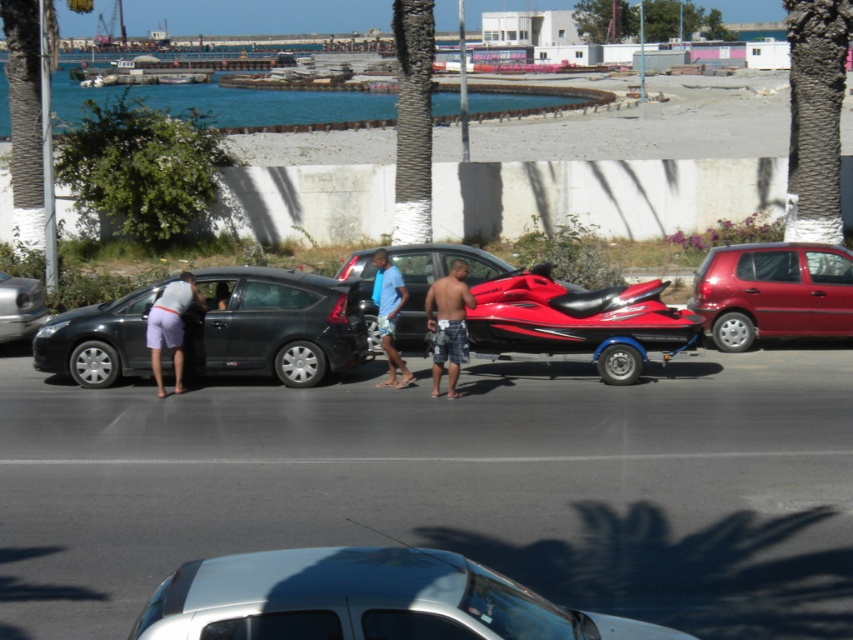
You are standing at the center of the image. There is a point at coordinates (273, 324). Which object from the scene is located at that point?

The point at coordinates (273, 324) corresponds to the matte black car at left.

You are a parking attendant who needs to ensure vehicles don not block the emergency exit. The emergency exit is located behind the metallic red car at right. Can you confirm if the matte black car at left is blocking the emergency exit based on their sizes?

The matte black car at left occupies less space than metallic red car at right, so it is possible that the smaller matte black car at left is not blocking the emergency exit located behind the metallic red car at right.